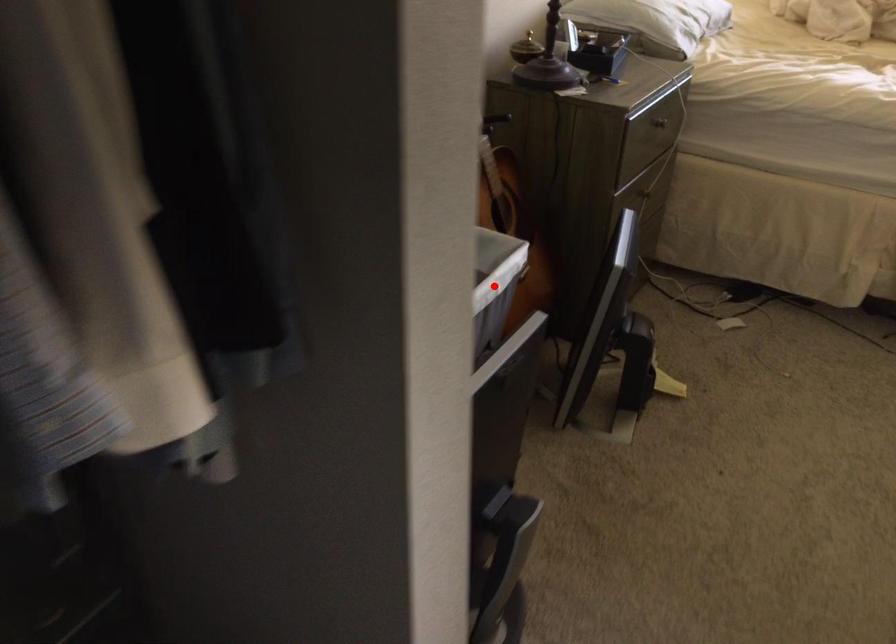
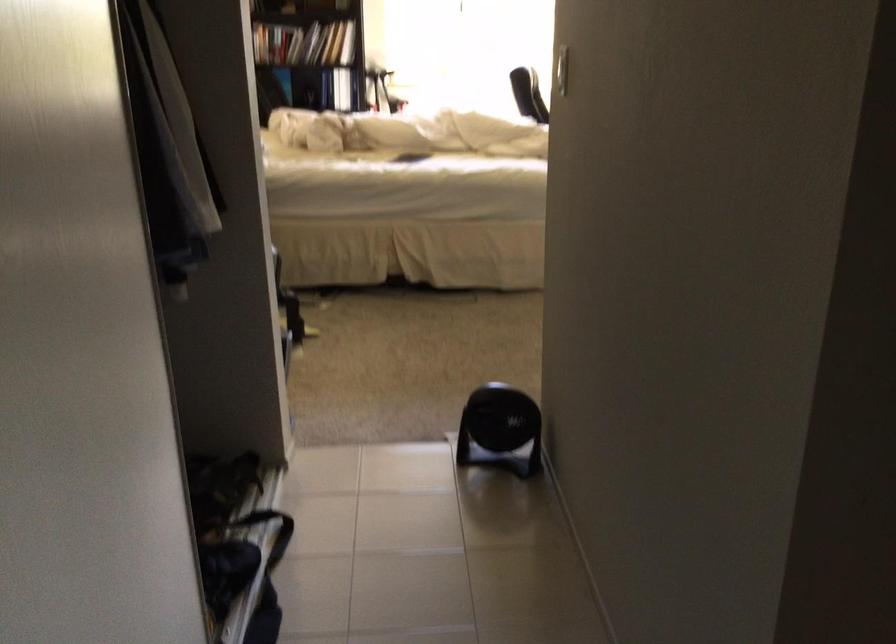
Question: I am providing you with two images of the same scene from different viewpoints. A red point is marked on the first image. Is the red point's position out of view in image 2?

Choices:
 (A) Yes
 (B) No

Answer: (A)